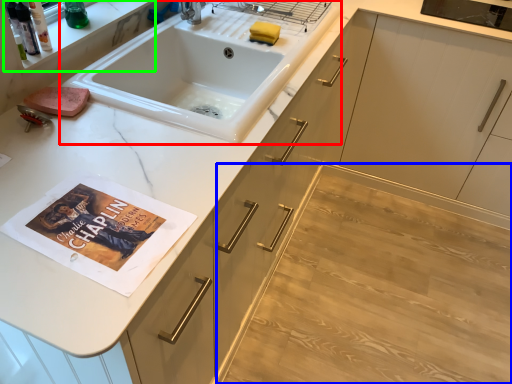
Question: Which object is positioned closest to sink (highlighted by a red box)? Select from plain (highlighted by a blue box) and shelf (highlighted by a green box).

Choices:
 (A) plain
 (B) shelf

Answer: (B)